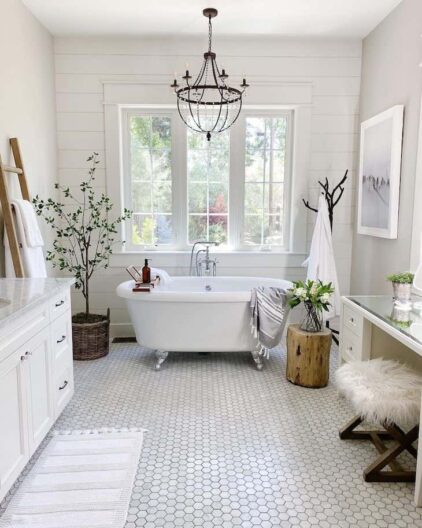
Identify the location of white towels. (27, 233).